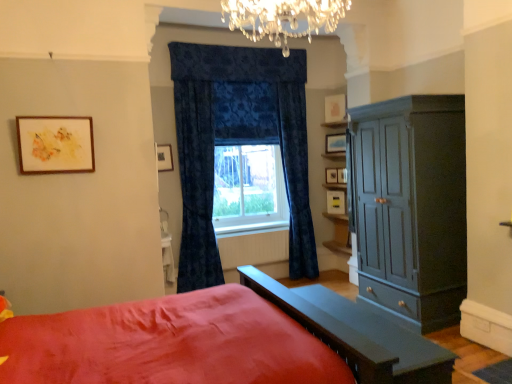
Describe the element at coordinates (196, 185) in the screenshot. I see `velvet blue curtain at center, the 1th curtain when ordered from left to right` at that location.

Where is `wooden framed artwork at upper left, placed as the first picture frame when sorted from left to right`? wooden framed artwork at upper left, placed as the first picture frame when sorted from left to right is located at coordinates (55, 144).

What do you see at coordinates (335, 143) in the screenshot? Image resolution: width=512 pixels, height=384 pixels. I see `wooden picture frame at upper right, the 2th picture frame from the right` at bounding box center [335, 143].

What are the coordinates of `white glossy table at lower center, acting as the 2th table starting from the right` in the screenshot? It's located at (167, 258).

I want to click on velvet blue curtain at center, positioned as the 2th curtain in right-to-left order, so click(196, 185).

Is velvet blue curtain at center, which is counted as the 2th curtain, starting from the left, next to white matte picture frame at upper center, the fifth picture frame when ordered from front to back, and touching it?

No.

Considering the relative positions of velvet blue curtain at center, the 1th curtain from the right, and white matte picture frame at upper center, which ranks as the 2th picture frame in back-to-front order, in the image provided, is velvet blue curtain at center, the 1th curtain from the right, to the right of white matte picture frame at upper center, which ranks as the 2th picture frame in back-to-front order, from the viewer's perspective?

In fact, velvet blue curtain at center, the 1th curtain from the right, is to the left of white matte picture frame at upper center, which ranks as the 2th picture frame in back-to-front order.

From the image's perspective, is velvet blue curtain at center, the 1th curtain from the right, on white matte picture frame at upper center, which ranks as the 2th picture frame in back-to-front order?

No, from the image's perspective, velvet blue curtain at center, the 1th curtain from the right, is not on top of white matte picture frame at upper center, which ranks as the 2th picture frame in back-to-front order.

From a real-world perspective, relative to white matte picture frame at upper center, which ranks as the 2th picture frame in back-to-front order, is velvet blue curtain at center, the 1th curtain from the right, vertically above or below?

velvet blue curtain at center, the 1th curtain from the right, is below white matte picture frame at upper center, which ranks as the 2th picture frame in back-to-front order.

From a real-world perspective, which table is the 2nd one underneath the wooden framed artwork at upper left, marked as the 6th picture frame in a back-to-front arrangement? Please provide its 2D coordinates.

[(357, 334)]

Looking at this image, from a real-world perspective, who is located higher, wooden framed artwork at upper left, the 6th picture frame viewed from the right, or matte gray table at lower center, acting as the second table starting from the back?

In real-world perspective, wooden framed artwork at upper left, the 6th picture frame viewed from the right, is above.

Can we say wooden framed artwork at upper left, placed as the first picture frame when sorted from left to right, lies outside matte gray table at lower center, acting as the second table starting from the back?

That's correct, wooden framed artwork at upper left, placed as the first picture frame when sorted from left to right, is outside of matte gray table at lower center, acting as the second table starting from the back.

Between wooden framed artwork at upper left, placed as the first picture frame when sorted from left to right, and matte gray table at lower center, which is counted as the 1th table, starting from the right, which one appears on the right side from the viewer's perspective?

matte gray table at lower center, which is counted as the 1th table, starting from the right, is more to the right.

Between point (164, 152) and point (77, 153), which one is positioned behind?

The point (164, 152) is behind.

Can you confirm if matte black picture frame at upper center, the fifth picture frame when ordered from right to left, is thinner than wooden framed artwork at upper left, placed as the first picture frame when sorted from left to right?

Indeed, matte black picture frame at upper center, the fifth picture frame when ordered from right to left, has a lesser width compared to wooden framed artwork at upper left, placed as the first picture frame when sorted from left to right.

Can you confirm if matte black picture frame at upper center, the 5th picture frame when ordered from back to front, is shorter than wooden framed artwork at upper left, which appears as the 1th picture frame when viewed from the front?

Yes.

From the image's perspective, is matte black picture frame at upper center, the fifth picture frame when ordered from right to left, below wooden framed artwork at upper left, marked as the 6th picture frame in a back-to-front arrangement?

Yes, from the image's perspective, matte black picture frame at upper center, the fifth picture frame when ordered from right to left, is beneath wooden framed artwork at upper left, marked as the 6th picture frame in a back-to-front arrangement.

From the picture: Is white glossy table at lower center, marked as the 1th table in a back-to-front arrangement, smaller than wooden framed artwork at upper left, marked as the 6th picture frame in a back-to-front arrangement?

Indeed, white glossy table at lower center, marked as the 1th table in a back-to-front arrangement, has a smaller size compared to wooden framed artwork at upper left, marked as the 6th picture frame in a back-to-front arrangement.

Which object is more forward, white glossy table at lower center, which is the second table from front to back, or wooden framed artwork at upper left, placed as the first picture frame when sorted from left to right?

wooden framed artwork at upper left, placed as the first picture frame when sorted from left to right, is more forward.

Is white glossy table at lower center, marked as the 1th table in a back-to-front arrangement, not near wooden framed artwork at upper left, placed as the first picture frame when sorted from left to right?

Indeed, white glossy table at lower center, marked as the 1th table in a back-to-front arrangement, is not near wooden framed artwork at upper left, placed as the first picture frame when sorted from left to right.

Considering the relative sizes of white glossy table at lower center, marked as the 1th table in a back-to-front arrangement, and wooden framed artwork at upper left, which appears as the 1th picture frame when viewed from the front, in the image provided, is white glossy table at lower center, marked as the 1th table in a back-to-front arrangement, shorter than wooden framed artwork at upper left, which appears as the 1th picture frame when viewed from the front,?

No, white glossy table at lower center, marked as the 1th table in a back-to-front arrangement, is not shorter than wooden framed artwork at upper left, which appears as the 1th picture frame when viewed from the front.

Considering the relative sizes of wooden picture frame at center, which is the third picture frame in back-to-front order, and matte black picture frame at upper center, the fifth picture frame when ordered from right to left, in the image provided, is wooden picture frame at center, which is the third picture frame in back-to-front order, wider than matte black picture frame at upper center, the fifth picture frame when ordered from right to left,?

In fact, wooden picture frame at center, which is the third picture frame in back-to-front order, might be narrower than matte black picture frame at upper center, the fifth picture frame when ordered from right to left.

Is wooden picture frame at center, placed as the 1th picture frame when sorted from right to left, facing away from matte black picture frame at upper center, arranged as the 2th picture frame when viewed from the front?

No, wooden picture frame at center, placed as the 1th picture frame when sorted from right to left, is not facing the opposite direction of matte black picture frame at upper center, arranged as the 2th picture frame when viewed from the front.

From the image's perspective, relative to matte black picture frame at upper center, the 5th picture frame when ordered from back to front, is wooden picture frame at center, which is the third picture frame in back-to-front order, above or below?

Clearly, from the image's perspective, wooden picture frame at center, which is the third picture frame in back-to-front order, is below matte black picture frame at upper center, the 5th picture frame when ordered from back to front.

Is wooden picture frame at center, placed as the 1th picture frame when sorted from right to left, with matte black picture frame at upper center, the 2th picture frame in the left-to-right sequence?

No.

Measure the distance from matte black picture frame at upper center, the fifth picture frame when ordered from right to left, to blue velvet curtains at center.

A distance of 99.69 centimeters exists between matte black picture frame at upper center, the fifth picture frame when ordered from right to left, and blue velvet curtains at center.

Considering the positions of point (159, 150) and point (229, 169), is point (159, 150) closer or farther from the camera than point (229, 169)?

Point (159, 150) appears to be closer to the viewer than point (229, 169).

Which object is positioned more to the left, matte black picture frame at upper center, the 2th picture frame in the left-to-right sequence, or blue velvet curtains at center?

From the viewer's perspective, matte black picture frame at upper center, the 2th picture frame in the left-to-right sequence, appears more on the left side.

Measure the distance from velvet blue curtain at center, the 1th curtain when ordered from left to right, to matte black picture frame at upper center, the 5th picture frame when ordered from back to front.

velvet blue curtain at center, the 1th curtain when ordered from left to right, is 22.71 inches away from matte black picture frame at upper center, the 5th picture frame when ordered from back to front.

How different are the orientations of velvet blue curtain at center, positioned as the 2th curtain in right-to-left order, and matte black picture frame at upper center, the 2th picture frame in the left-to-right sequence, in degrees?

0.603 degrees separate the facing orientations of velvet blue curtain at center, positioned as the 2th curtain in right-to-left order, and matte black picture frame at upper center, the 2th picture frame in the left-to-right sequence.

Does velvet blue curtain at center, positioned as the 2th curtain in right-to-left order, have a larger size compared to matte black picture frame at upper center, arranged as the 2th picture frame when viewed from the front?

Yes.

Is velvet blue curtain at center, positioned as the 2th curtain in right-to-left order, located outside matte black picture frame at upper center, the 5th picture frame when ordered from back to front?

Indeed, velvet blue curtain at center, positioned as the 2th curtain in right-to-left order, is completely outside matte black picture frame at upper center, the 5th picture frame when ordered from back to front.

Starting from the white matte picture frame at upper center, which ranks as the 2th picture frame in back-to-front order, which curtain is the 1st one to the left? Please provide its 2D coordinates.

[(296, 178)]

What are the coordinates of `the 2nd table below the wooden framed artwork at upper left, marked as the 6th picture frame in a back-to-front arrangement (from the image's perspective)` in the screenshot? It's located at (357, 334).

Considering their positions, is wooden picture frame at upper right, placed as the fifth picture frame when sorted from left to right, positioned closer to wooden picture frame at center, placed as the 1th picture frame when sorted from right to left, than velvet blue curtain at center, which is counted as the 2th curtain, starting from the left?

wooden picture frame at upper right, placed as the fifth picture frame when sorted from left to right, is positioned closer to the anchor wooden picture frame at center, placed as the 1th picture frame when sorted from right to left.

When comparing their distances from matte gray cabinet at right, does velvet blue curtain at center, positioned as the 2th curtain in right-to-left order, or white painted radiator at center seem further?

velvet blue curtain at center, positioned as the 2th curtain in right-to-left order, is further to matte gray cabinet at right.

When comparing their distances from wooden picture frame at upper center, the 3th picture frame when ordered from left to right, does blue velvet curtains at center or velvet blue curtain at center, which is counted as the 2th curtain, starting from the left, seem closer?

Based on the image, velvet blue curtain at center, which is counted as the 2th curtain, starting from the left, appears to be nearer to wooden picture frame at upper center, the 3th picture frame when ordered from left to right.

Based on their spatial positions, is velvet blue curtain at center, positioned as the 2th curtain in right-to-left order, or matte gray table at lower center, acting as the second table starting from the back, further from wooden picture frame at upper right, the 2th picture frame from the right?

matte gray table at lower center, acting as the second table starting from the back, is further to wooden picture frame at upper right, the 2th picture frame from the right.

Considering their positions, is white painted radiator at center positioned further to wooden framed artwork at upper left, placed as the first picture frame when sorted from left to right, than velvet blue curtain at center, positioned as the 2th curtain in right-to-left order?

The object further to wooden framed artwork at upper left, placed as the first picture frame when sorted from left to right, is white painted radiator at center.

Considering their positions, is velvet blue curtain at center, the 1th curtain when ordered from left to right, positioned further to white matte picture frame at upper center, the 4th picture frame in the left-to-right sequence, than wooden picture frame at upper right, positioned as the 4th picture frame in back-to-front order?

velvet blue curtain at center, the 1th curtain when ordered from left to right.

Based on their spatial positions, is matte black picture frame at upper center, the 2th picture frame in the left-to-right sequence, or velvet blue curtain at center, the 1th curtain from the right, closer to matte gray table at lower center, positioned as the 2th table in left-to-right order?

velvet blue curtain at center, the 1th curtain from the right.

Based on their spatial positions, is white matte picture frame at upper center, which ranks as the 3th picture frame in right-to-left order, or wooden picture frame at center, which is the third picture frame in back-to-front order, further from wooden framed artwork at upper left, which appears as the 1th picture frame when viewed from the front?

The object further to wooden framed artwork at upper left, which appears as the 1th picture frame when viewed from the front, is white matte picture frame at upper center, which ranks as the 3th picture frame in right-to-left order.

I want to click on table between blue velvet curtains at center and white painted radiator at center from top to bottom, so click(167, 258).

Locate an element on the screen. Image resolution: width=512 pixels, height=384 pixels. picture frame between wooden framed artwork at upper left, placed as the first picture frame when sorted from left to right, and velvet blue curtain at center, which is counted as the 2th curtain, starting from the left, from left to right is located at coordinates (164, 157).

Where is `radiator between matte gray cabinet at right and wooden picture frame at upper center, which is the first picture frame from back to front, from front to back`? The image size is (512, 384). radiator between matte gray cabinet at right and wooden picture frame at upper center, which is the first picture frame from back to front, from front to back is located at coordinates (253, 248).

Find the location of a particular element. radiator situated between wooden framed artwork at upper left, placed as the first picture frame when sorted from left to right, and wooden picture frame at upper center, which is the first picture frame from back to front, from left to right is located at coordinates (253, 248).